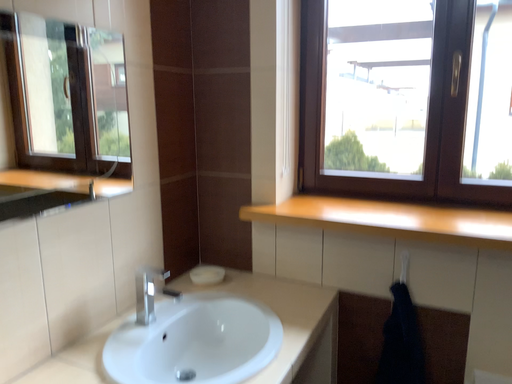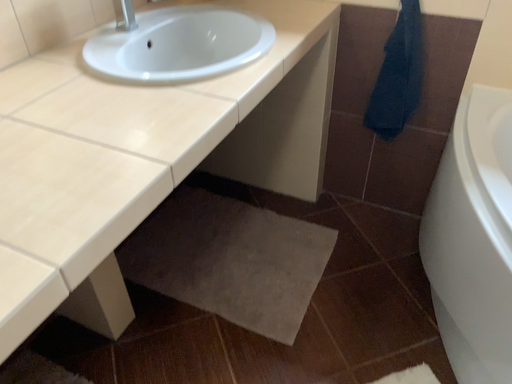
Question: How did the camera likely rotate when shooting the video?

Choices:
 (A) rotated downward
 (B) rotated upward

Answer: (A)